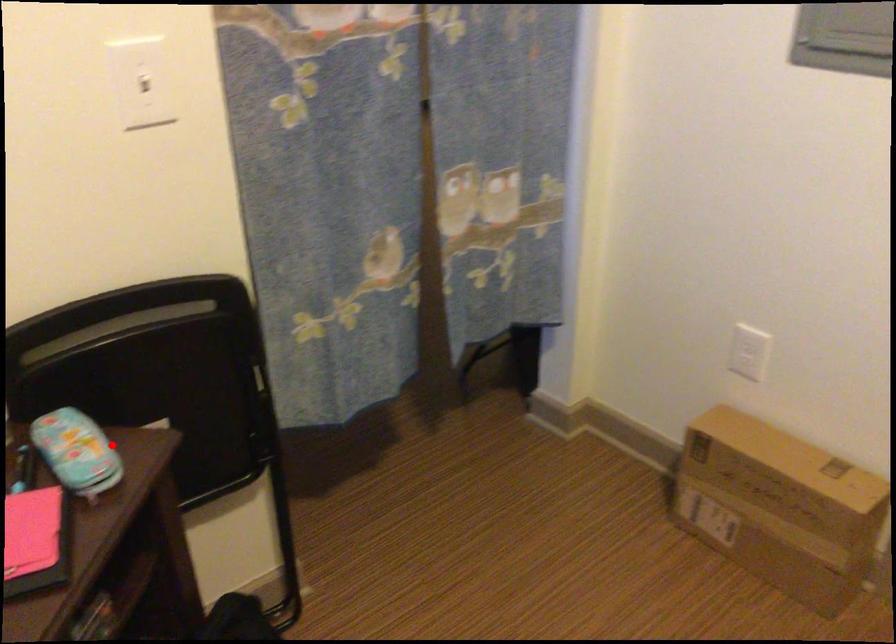
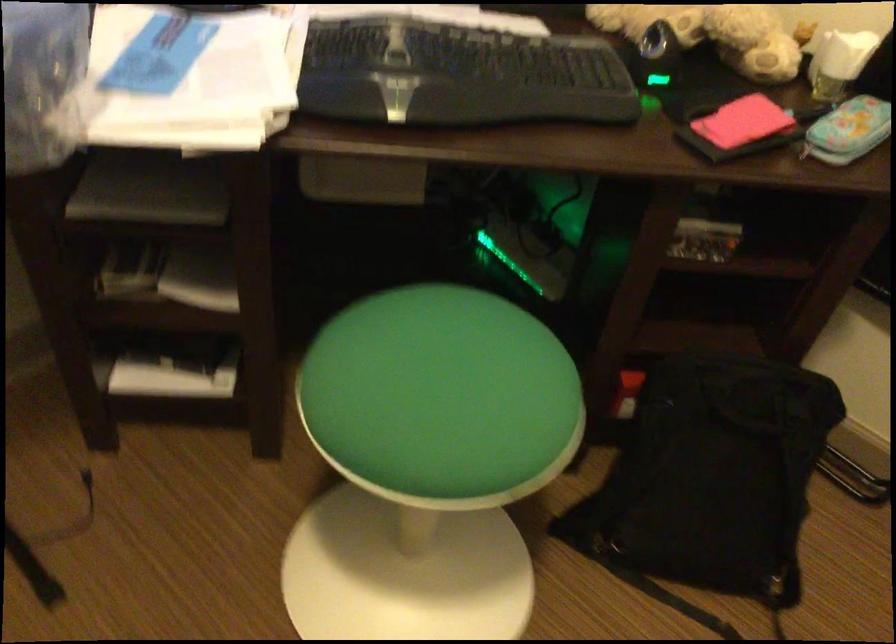
In the second image, find the point that corresponds to the highlighted location in the first image.

(848, 129)